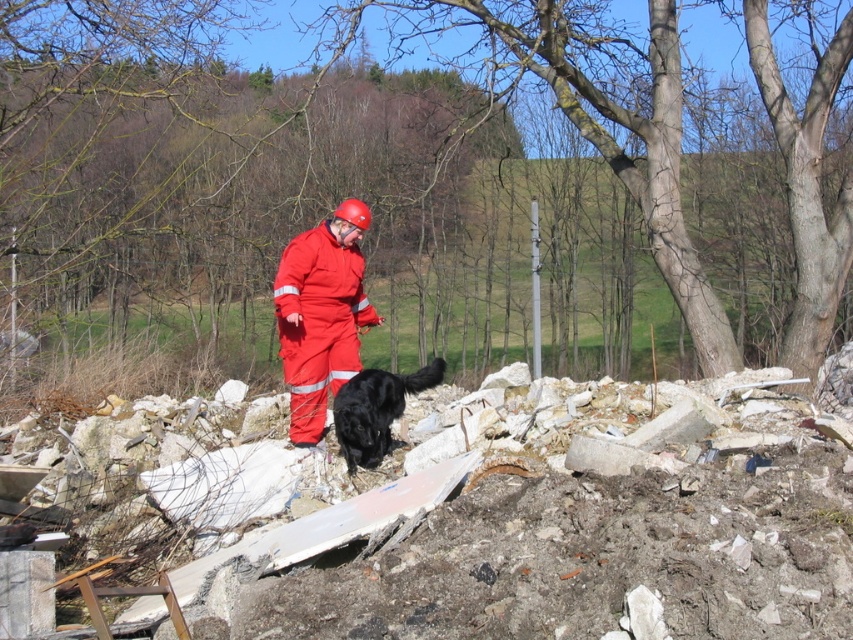
You are a drone operator trying to map the debris field. You have two coordinates in the scene, point (283, 275) and point (354, 465). Which coordinate is closer to your drone camera?

Point (283, 275) is further to the viewer than point (354, 465), so the coordinate closer to the drone camera is point (354, 465).

You are a photographer trying to capture a clear shot of both the matte red jumpsuit at center and the black fur dog at center. Since you want to ensure both subjects are fully visible in the frame, which subject should you adjust your camera focus to prioritize based on their sizes?

The matte red jumpsuit at center has a lesser width compared to black fur dog at center, so you should prioritize focusing on the black fur dog at center to ensure its details are sharp while still capturing the smaller jumpsuit in the frame.